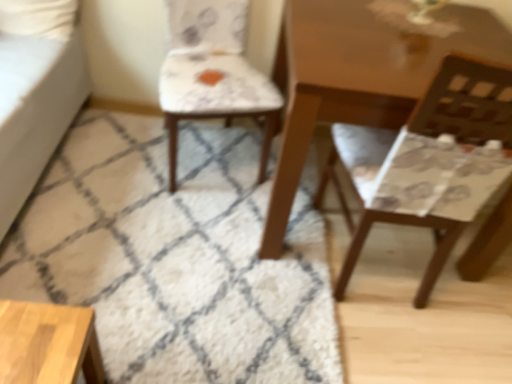
Where is `blank space to the left of patterned fabric chair at center, the second chair viewed from the right`? The height and width of the screenshot is (384, 512). blank space to the left of patterned fabric chair at center, the second chair viewed from the right is located at coordinates (117, 147).